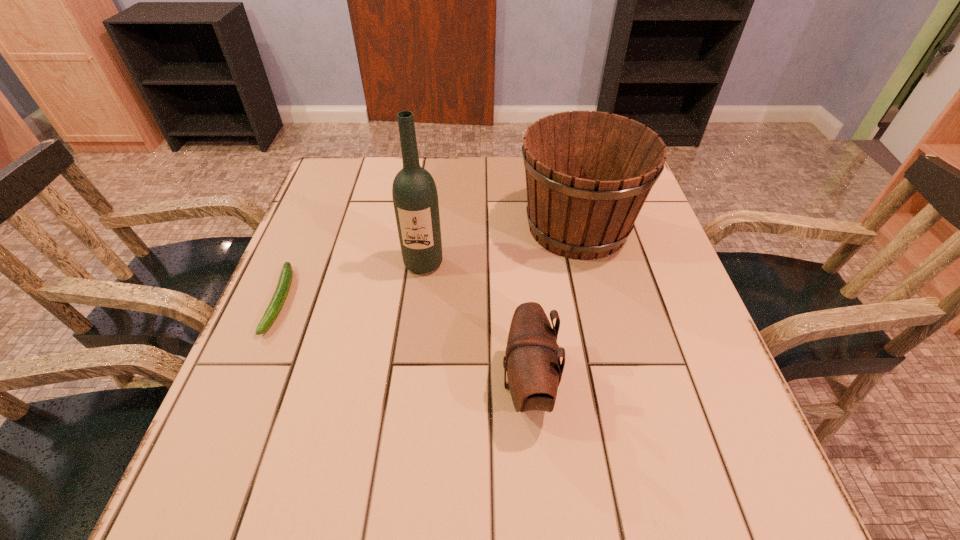
Locate which object ranks third in proximity to the pouch. Please provide its 2D coordinates. Your answer should be formatted as a tuple, i.e. [(x, y)], where the tuple contains the x and y coordinates of a point satisfying the conditions above.

[(286, 275)]

Identify which object is located as the second nearest to the nearest object. Please provide its 2D coordinates. Your answer should be formatted as a tuple, i.e. [(x, y)], where the tuple contains the x and y coordinates of a point satisfying the conditions above.

[(415, 198)]